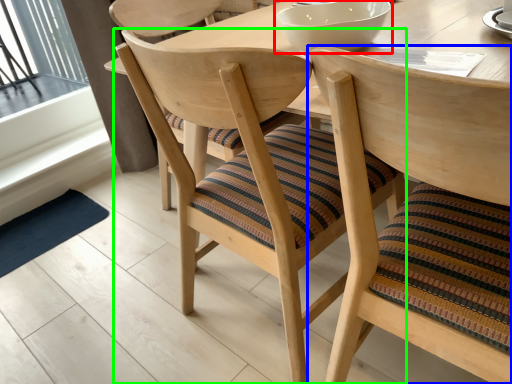
Question: Estimate the real-world distances between objects in this image. Which object is farther from bowl (highlighted by a red box), chair (highlighted by a blue box) or chair (highlighted by a green box)?

Choices:
 (A) chair
 (B) chair

Answer: (A)